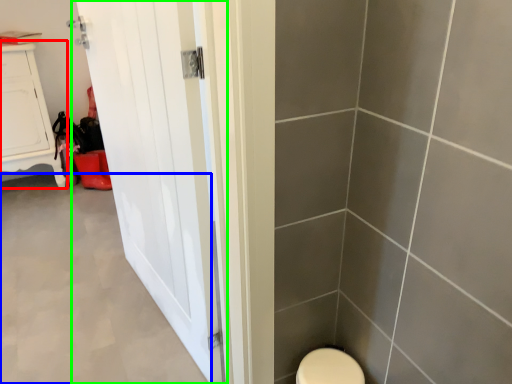
Question: Based on their relative distances, which object is nearer to furniture (highlighted by a red box)? Choose from plain (highlighted by a blue box) and door (highlighted by a green box).

Choices:
 (A) plain
 (B) door

Answer: (A)